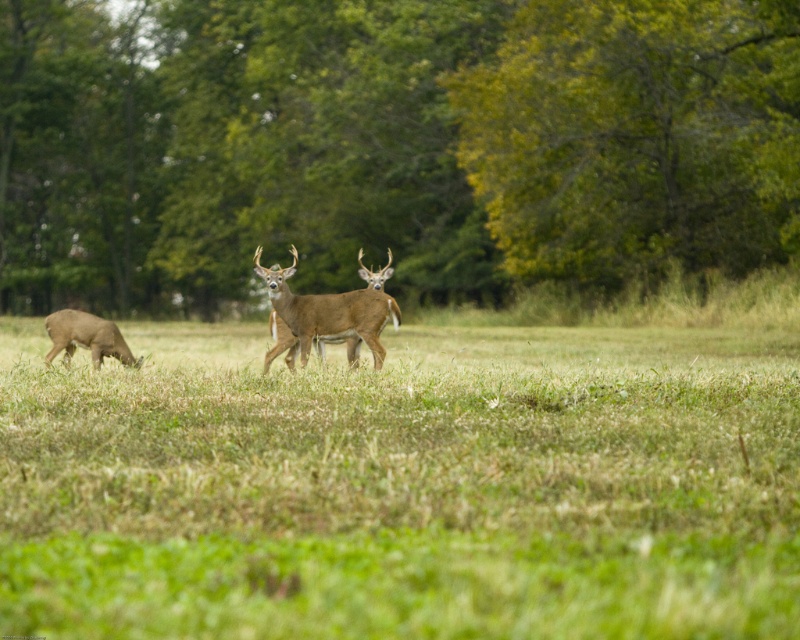
Which is more to the right, brown velvet deer at center or brown fur deer at left?

Positioned to the right is brown velvet deer at center.

Is brown velvet deer at center below brown fur deer at left?

No.

Identify the location of brown velvet deer at center. The width and height of the screenshot is (800, 640). (324, 316).

Which of these two, green grass at center or brown velvet deer at center, stands shorter?

green grass at center

Is point (720, 470) closer to camera compared to point (348, 346)?

Yes.

Between point (270, 632) and point (346, 300), which one is positioned in front?

Point (270, 632)

You are a GUI agent. You are given a task and a screenshot of the screen. Output one action in this format:
    pyautogui.click(x=<x>, y=<y>)
    Task: Click on the green grass at center
    The height and width of the screenshot is (640, 800).
    Given the screenshot: What is the action you would take?
    pyautogui.click(x=404, y=486)

Between point (733, 387) and point (118, 333), which one is positioned in front?

Point (733, 387)

Which is more to the right, green grass at center or brown fur deer at left?

green grass at center

Where is `green grass at center`? green grass at center is located at coordinates (404, 486).

Image resolution: width=800 pixels, height=640 pixels. I want to click on green grass at center, so click(404, 486).